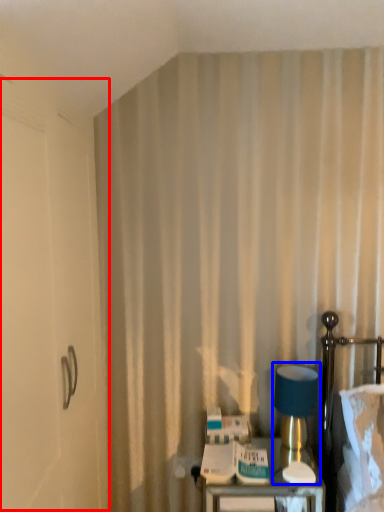
Question: Which object appears closest to the camera in this image, screen door (highlighted by a red box) or table lamp (highlighted by a blue box)?

Choices:
 (A) screen door
 (B) table lamp

Answer: (A)